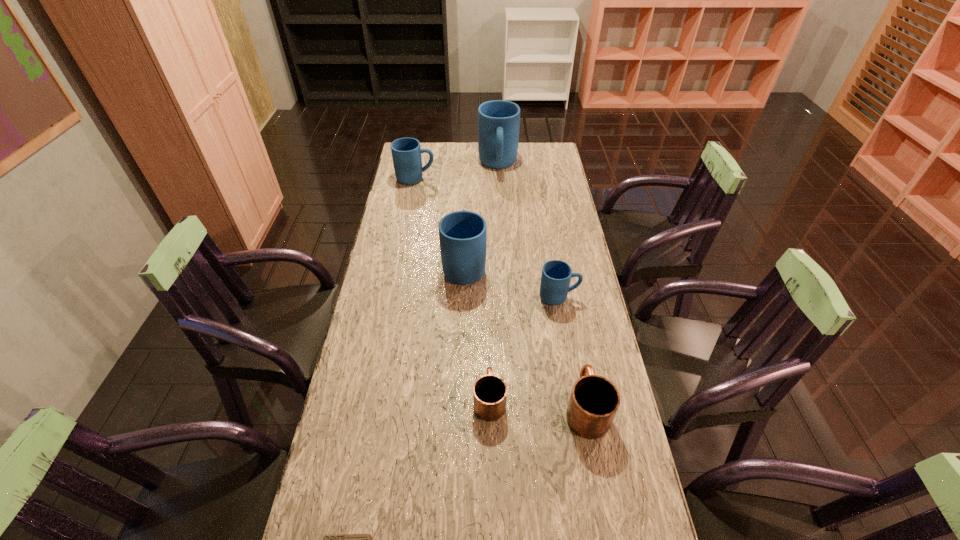
The width and height of the screenshot is (960, 540). Find the location of `vacant space located on the side of the tallest mug with the handle`. vacant space located on the side of the tallest mug with the handle is located at coordinates (500, 200).

Where is `free space located on the side of the fifth shortest mug with the handle`? The image size is (960, 540). free space located on the side of the fifth shortest mug with the handle is located at coordinates (466, 219).

Find the location of a particular element. This screenshot has height=540, width=960. free spot located on the side of the fifth shortest mug with the handle is located at coordinates (466, 222).

Identify the location of vacant space located 0.220m on the side of the fifth shortest mug with the handle. (467, 211).

Image resolution: width=960 pixels, height=540 pixels. What are the coordinates of `free space located 0.090m on the side of the second smallest blue mug with the handle` in the screenshot? It's located at (455, 179).

The image size is (960, 540). I want to click on vacant space located 0.050m on the side of the rightmost blue mug with the handle, so click(593, 297).

This screenshot has height=540, width=960. I want to click on free spot located on the side of the bigger rust mug with the handle, so click(x=566, y=299).

Find the location of a particular element. The height and width of the screenshot is (540, 960). vacant area situated on the side of the bigger rust mug with the handle is located at coordinates (566, 301).

Locate an element on the screen. vacant space located 0.160m on the side of the bigger rust mug with the handle is located at coordinates (573, 334).

At what (x,y) coordinates should I click in order to perform the action: click on vacant space situated 0.050m on the side of the left rust mug with the handle. Please return your answer as a coordinate pair (x, y). Looking at the image, I should click on (489, 363).